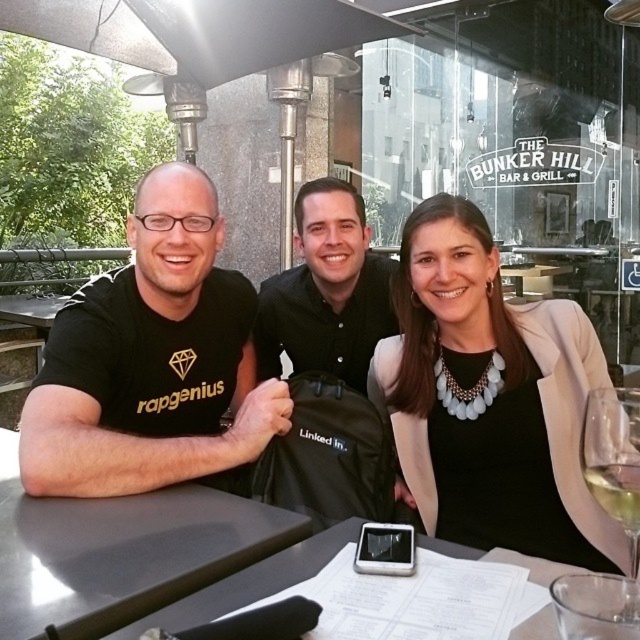
Question: From the image, what is the correct spatial relationship of black matte t-shirt at left in relation to black shirt at center?

Choices:
 (A) right
 (B) left

Answer: (B)

Question: Among these points, which one is farthest from the camera?

Choices:
 (A) (595, 444)
 (B) (611, 461)
 (C) (147, 404)

Answer: (C)

Question: Which point appears closest to the camera in this image?

Choices:
 (A) (332, 250)
 (B) (611, 458)
 (C) (636, 532)
 (D) (580, 380)

Answer: (C)

Question: Is clear glass wine glass at lower right bigger than white glass at lower right?

Choices:
 (A) no
 (B) yes

Answer: (B)

Question: Does black fabric jacket at center have a greater width compared to white glass at lower right?

Choices:
 (A) no
 (B) yes

Answer: (B)

Question: Among these points, which one is nearest to the camera?

Choices:
 (A) (205, 269)
 (B) (595, 401)
 (C) (572, 476)

Answer: (B)